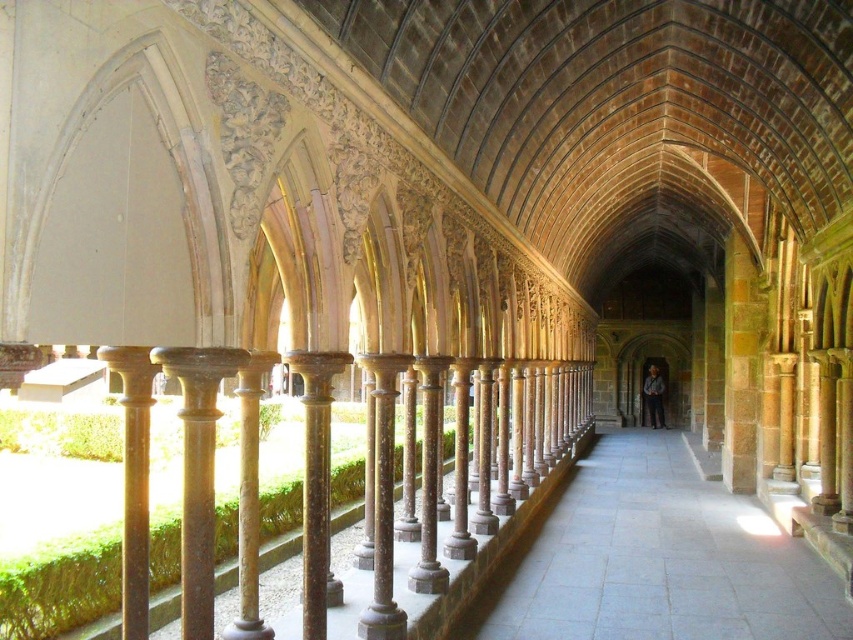
Question: Estimate the real-world distances between objects in this image. Which object is closer to the wooden figure at center?

Choices:
 (A) gray stone path at center
 (B) brown polished stone pillar at left

Answer: (A)

Question: Which point appears farthest from the camera in this image?

Choices:
 (A) (138, 472)
 (B) (657, 369)

Answer: (B)

Question: Is gray stone path at center smaller than wooden figure at center?

Choices:
 (A) no
 (B) yes

Answer: (A)

Question: Can you confirm if gray stone path at center is smaller than wooden figure at center?

Choices:
 (A) yes
 (B) no

Answer: (B)

Question: From the image, what is the correct spatial relationship of brown polished stone pillar at left in relation to wooden figure at center?

Choices:
 (A) below
 (B) above

Answer: (B)

Question: Which of the following is the farthest from the observer?

Choices:
 (A) wooden figure at center
 (B) gray stone path at center

Answer: (A)